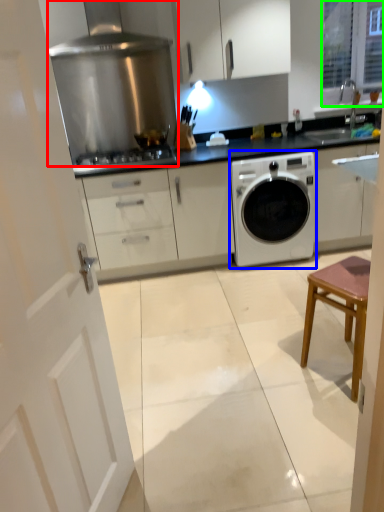
Question: Which object is the farthest from home appliance (highlighted by a red box)? Choose among these: washing machine (highlighted by a blue box) or window (highlighted by a green box).

Choices:
 (A) washing machine
 (B) window

Answer: (B)